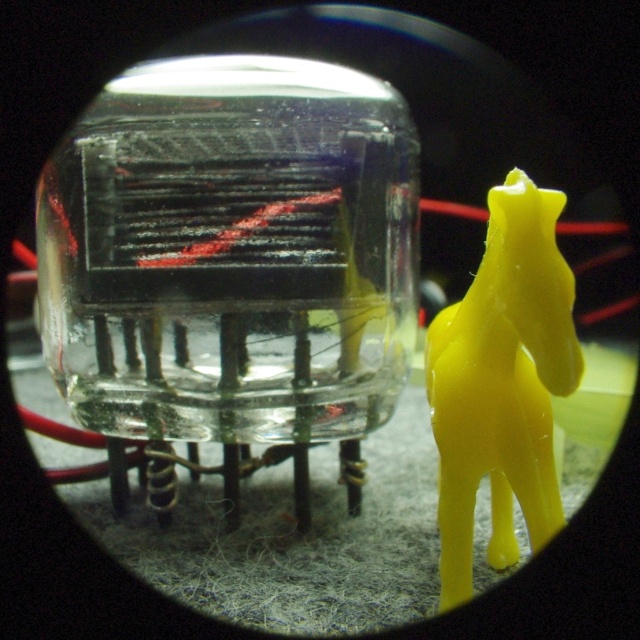
Question: Considering the relative positions of transparent glass tube at center and yellow matte plastic horse at right in the image provided, where is transparent glass tube at center located with respect to yellow matte plastic horse at right?

Choices:
 (A) right
 (B) left

Answer: (B)

Question: Which object is closer to the camera taking this photo?

Choices:
 (A) yellow matte plastic horse at right
 (B) transparent glass tube at center

Answer: (A)

Question: Does transparent glass tube at center have a lesser width compared to yellow matte plastic horse at right?

Choices:
 (A) yes
 (B) no

Answer: (B)

Question: Does transparent glass tube at center have a lesser width compared to yellow matte plastic horse at right?

Choices:
 (A) yes
 (B) no

Answer: (B)